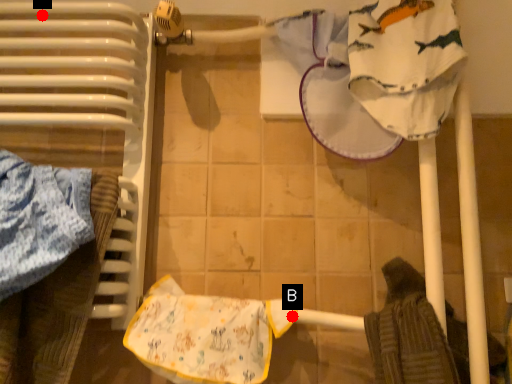
Question: Two points are circled on the image, labeled by A and B beside each circle. Which point is closer to the camera?

Choices:
 (A) A is closer
 (B) B is closer

Answer: (B)